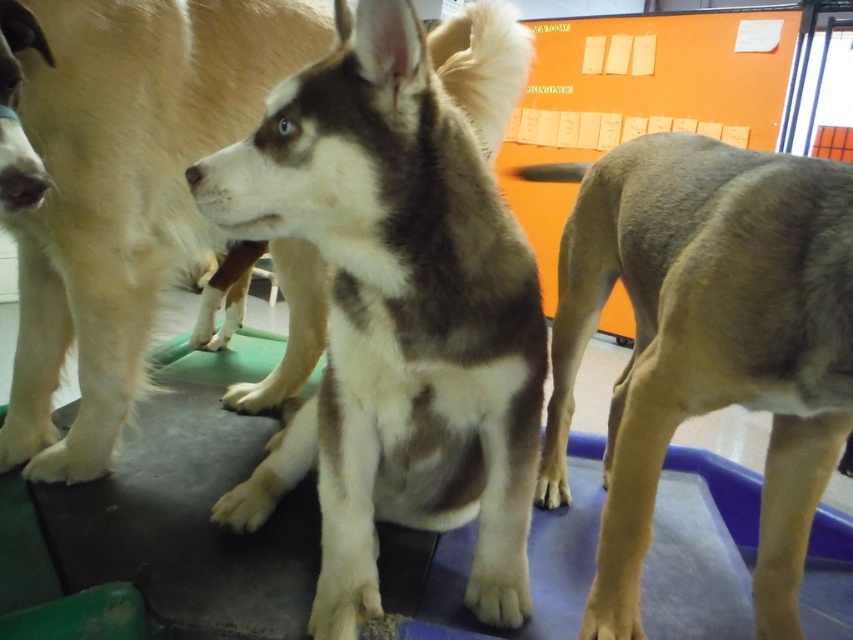
Question: Which object is farther from the camera taking this photo?

Choices:
 (A) brown fur dog at right
 (B) brown and white fur at center

Answer: (A)

Question: Is brown and white fur at center bigger than brown fur dog at right?

Choices:
 (A) yes
 (B) no

Answer: (B)

Question: In this image, where is brown and white fur at center located relative to brown fur dog at right?

Choices:
 (A) left
 (B) right

Answer: (A)

Question: Is brown and white fur at center to the left of brown fur dog at right from the viewer's perspective?

Choices:
 (A) yes
 (B) no

Answer: (A)